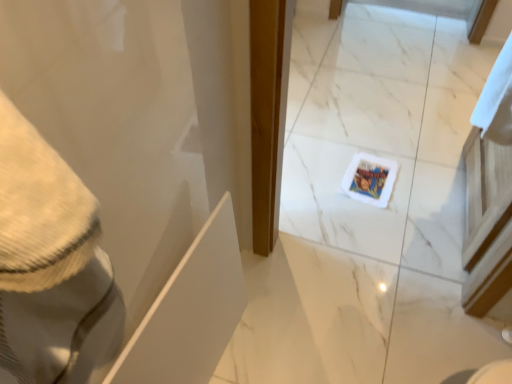
Where is `vacant space in front of white plastic container at center`? The image size is (512, 384). vacant space in front of white plastic container at center is located at coordinates (382, 231).